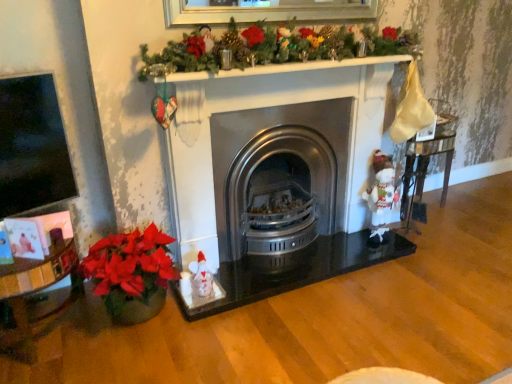
Question: Could you tell me if stainless steel wood burning stove at center is turned towards white plush santa at right?

Choices:
 (A) yes
 (B) no

Answer: (B)

Question: Does stainless steel wood burning stove at center appear on the left side of white plush santa at right?

Choices:
 (A) yes
 (B) no

Answer: (A)

Question: Considering the relative positions of stainless steel wood burning stove at center and white plush santa at right in the image provided, is stainless steel wood burning stove at center to the right of white plush santa at right from the viewer's perspective?

Choices:
 (A) yes
 (B) no

Answer: (B)

Question: Is stainless steel wood burning stove at center turned away from white plush santa at right?

Choices:
 (A) no
 (B) yes

Answer: (A)

Question: Is the position of stainless steel wood burning stove at center more distant than that of white plush santa at right?

Choices:
 (A) no
 (B) yes

Answer: (A)

Question: Considering the positions of stainless steel wood burning stove at center and white plush santa at right in the image, is stainless steel wood burning stove at center bigger or smaller than white plush santa at right?

Choices:
 (A) small
 (B) big

Answer: (B)

Question: From the image's perspective, is stainless steel wood burning stove at center positioned above or below white plush santa at right?

Choices:
 (A) above
 (B) below

Answer: (A)

Question: Is stainless steel wood burning stove at center situated inside white plush santa at right or outside?

Choices:
 (A) inside
 (B) outside

Answer: (B)

Question: From a real-world perspective, is stainless steel wood burning stove at center physically located above or below white plush santa at right?

Choices:
 (A) above
 (B) below

Answer: (A)

Question: Is wooden glossy table at right to the left or to the right of stainless steel wood burning stove at center in the image?

Choices:
 (A) right
 (B) left

Answer: (A)

Question: From the image's perspective, is wooden glossy table at right positioned above or below stainless steel wood burning stove at center?

Choices:
 (A) above
 (B) below

Answer: (A)

Question: Is wooden glossy table at right wider or thinner than stainless steel wood burning stove at center?

Choices:
 (A) wide
 (B) thin

Answer: (B)

Question: From a real-world perspective, is wooden glossy table at right above or below stainless steel wood burning stove at center?

Choices:
 (A) below
 (B) above

Answer: (A)

Question: Is stainless steel wood burning stove at center inside the boundaries of wooden glossy table at right, or outside?

Choices:
 (A) outside
 (B) inside

Answer: (A)

Question: From a real-world perspective, is stainless steel wood burning stove at center positioned above or below wooden glossy table at right?

Choices:
 (A) above
 (B) below

Answer: (A)